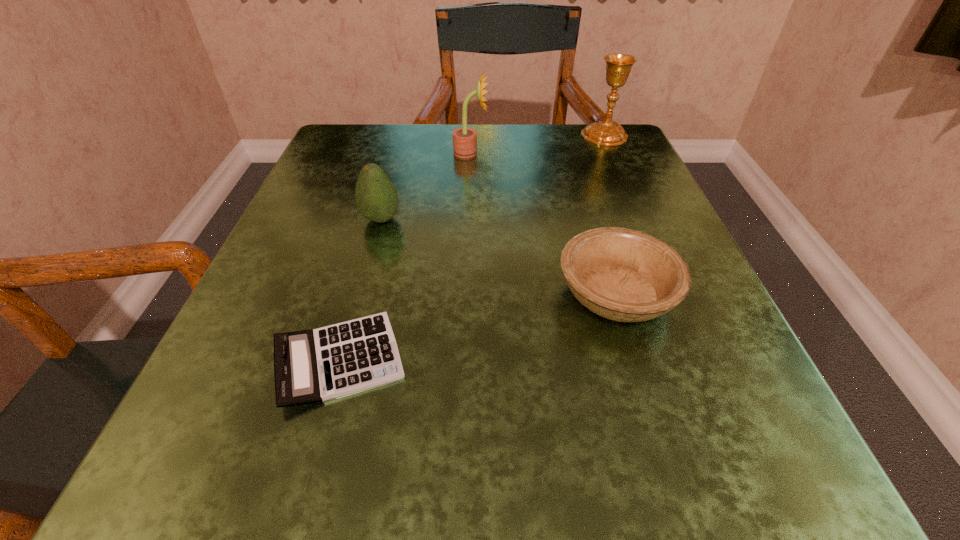
Identify the location of free space at the left edge. The image size is (960, 540). (298, 198).

You are a GUI agent. You are given a task and a screenshot of the screen. Output one action in this format:
    pyautogui.click(x=<x>, y=<y>)
    Task: Click on the free space at the right edge of the desktop
    
    Given the screenshot: What is the action you would take?
    coord(649,199)

You are a GUI agent. You are given a task and a screenshot of the screen. Output one action in this format:
    pyautogui.click(x=<x>, y=<y>)
    Task: Click on the vacant space at the far left corner
    This screenshot has width=960, height=540.
    Given the screenshot: What is the action you would take?
    pyautogui.click(x=352, y=174)

In the image, there is a desktop. Identify the location of vacant region at the near left corner. The width and height of the screenshot is (960, 540). (188, 477).

In the image, there is a desktop. Where is `blank space at the far right corner`? The height and width of the screenshot is (540, 960). blank space at the far right corner is located at coordinates (643, 167).

Where is `free region at the near right corner of the desktop`? This screenshot has width=960, height=540. free region at the near right corner of the desktop is located at coordinates 752,498.

I want to click on empty location between the third farthest object and the third object from right to left, so click(x=425, y=186).

The height and width of the screenshot is (540, 960). I want to click on free spot between the sunflower and the calculator, so click(405, 256).

I want to click on empty space that is in between the sunflower and the second shortest object, so click(543, 224).

This screenshot has width=960, height=540. Identify the location of free space between the third farthest object and the third object from right to left. (425, 186).